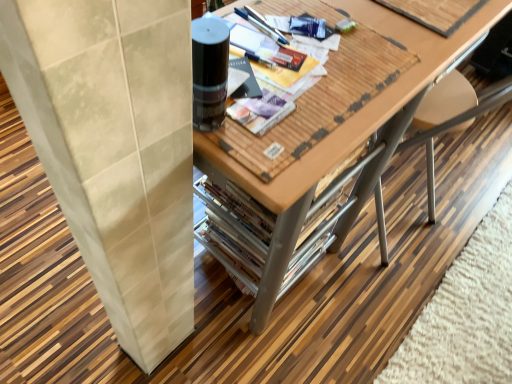
I want to click on vacant space in front of matte black magazine at center, the 2th magazine positioned from the right, so coord(290,140).